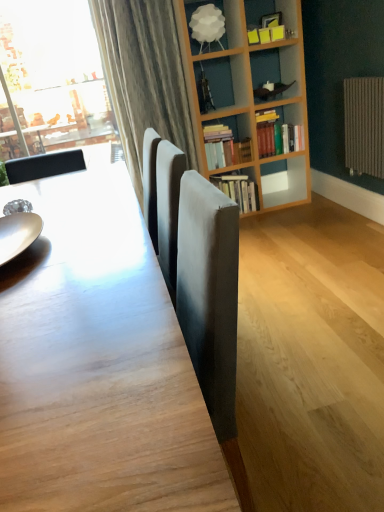
Question: Is hardcover books at upper right, the second book from the top, in front of or behind slightly worn paper book at center, the first book from the bottom, in the image?

Choices:
 (A) front
 (B) behind

Answer: (A)

Question: Would you say hardcover books at upper right, the second book from the bottom, is to the left or to the right of slightly worn paper book at center, which is the third book from top to bottom, in the picture?

Choices:
 (A) left
 (B) right

Answer: (A)

Question: Considering the real-world distances, which object is closest to the white matte lampshade at upper center?

Choices:
 (A) hardcover books at center, arranged as the first book when viewed from the top
 (B) shiny silver plate at left
 (C) slightly worn paper book at center, which is the third book from top to bottom
 (D) wooden table at center
 (E) hardcover books at upper right, the second book from the top

Answer: (E)

Question: Which object is the farthest from the hardcover books at upper right, the second book from the bottom?

Choices:
 (A) slightly worn paper book at center, which is the third book from top to bottom
 (B) hardcover books at center, which ranks as the third book in bottom-to-top order
 (C) shiny silver plate at left
 (D) wooden table at center
 (E) white matte lampshade at upper center

Answer: (D)